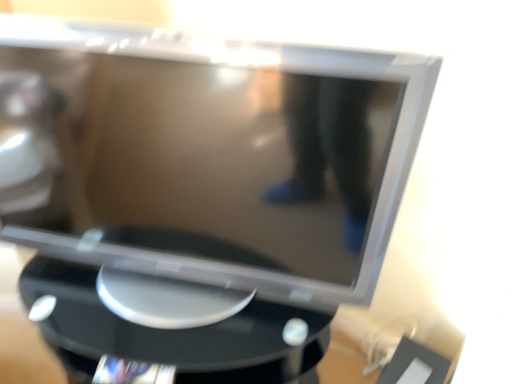
Where is `satin black monitor at center`? The height and width of the screenshot is (384, 512). satin black monitor at center is located at coordinates (206, 159).

In order to face satin black monitor at center, should I rotate leftwards or rightwards?

You should look left and rotate roughly 13.553 degrees.

This screenshot has height=384, width=512. What do you see at coordinates (206, 159) in the screenshot? I see `satin black monitor at center` at bounding box center [206, 159].

What is the approximate height of satin black monitor at center?

It is 25.12 inches.

Measure the distance between satin black monitor at center and camera.

They are 22.69 inches apart.

At what (x,y) coordinates should I click in order to perform the action: click on satin black monitor at center. Please return your answer as a coordinate pair (x, y). The image size is (512, 384). Looking at the image, I should click on (x=206, y=159).